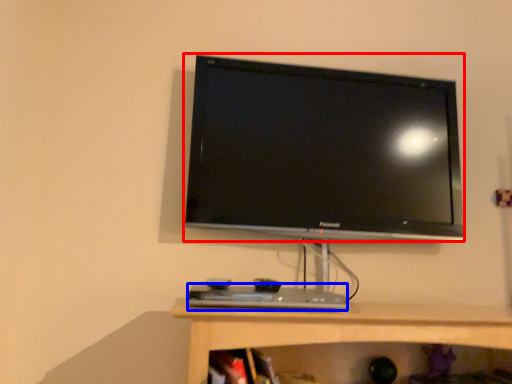
Question: Which object is further to the camera taking this photo, television (highlighted by a red box) or desktop (highlighted by a blue box)?

Choices:
 (A) television
 (B) desktop

Answer: (A)